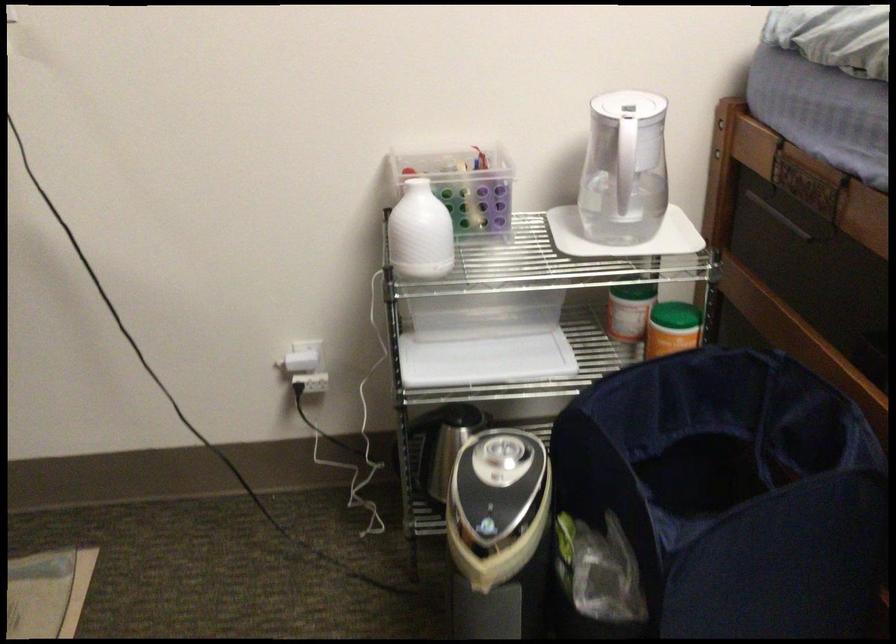
Where is `green jar lid`? This screenshot has width=896, height=644. green jar lid is located at coordinates (635, 325).